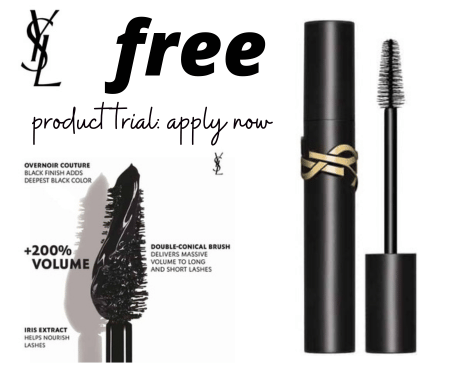
Where is `makeup`? The image size is (450, 375). makeup is located at coordinates (117, 225).